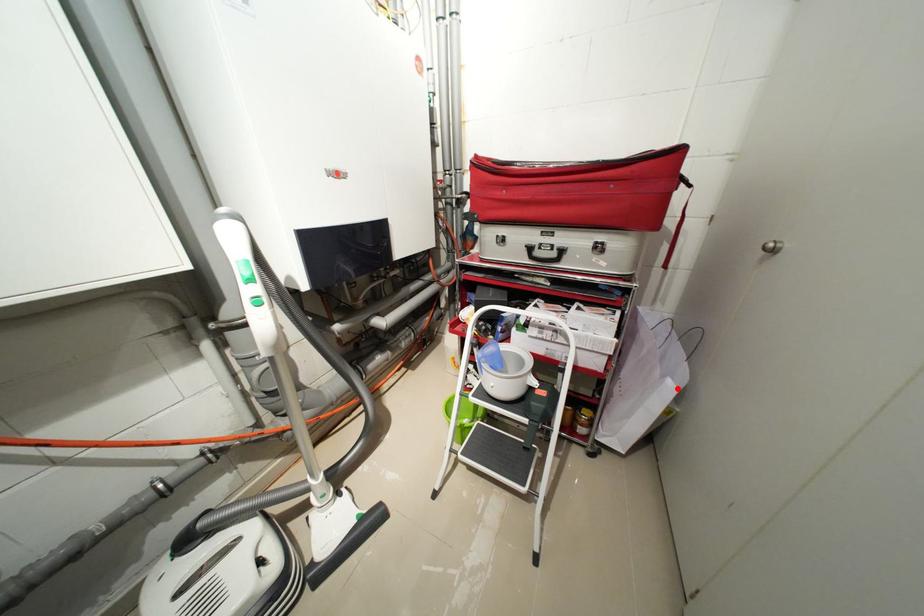
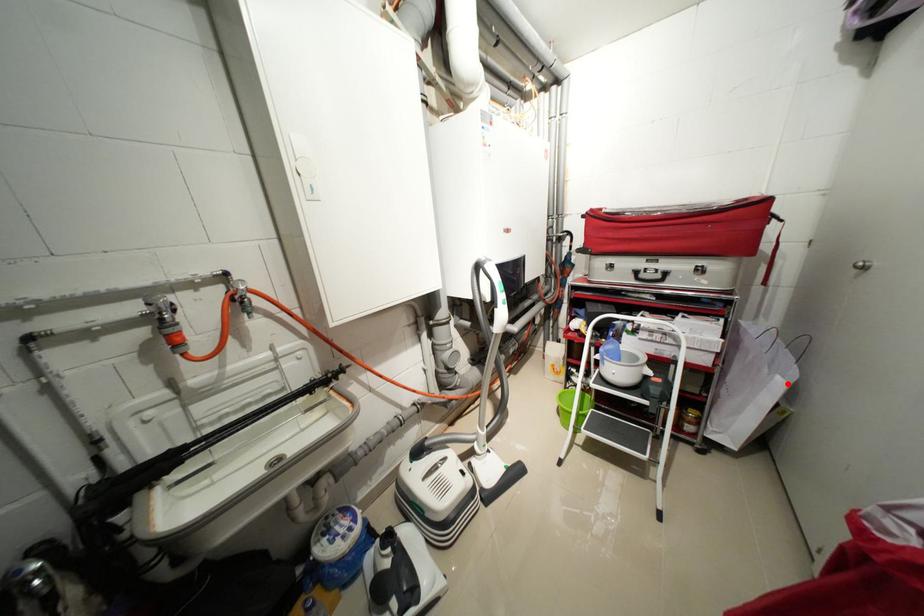
I am providing you with two images of the same scene from different viewpoints. A red point is marked on the first image and another point is marked on the second image. Does the point marked in image1 correspond to the same location as the one in image2?

Yes